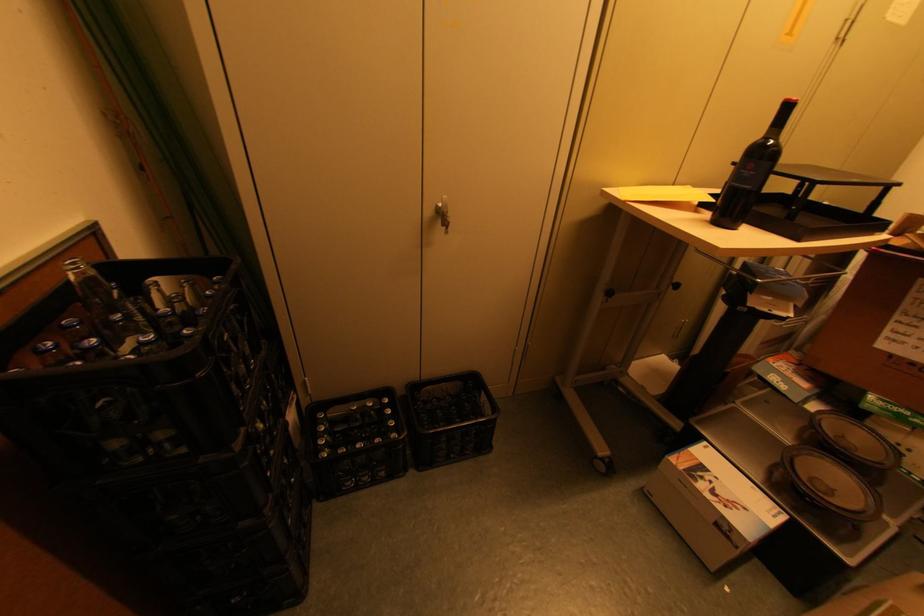
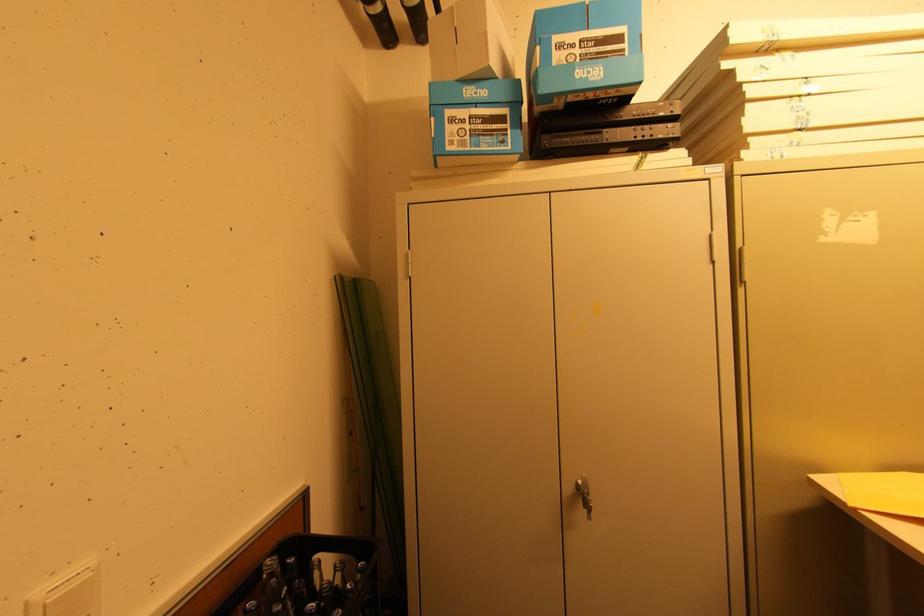
The point at (451,233) is marked in the first image. Where is the corresponding point in the second image?

(592, 519)